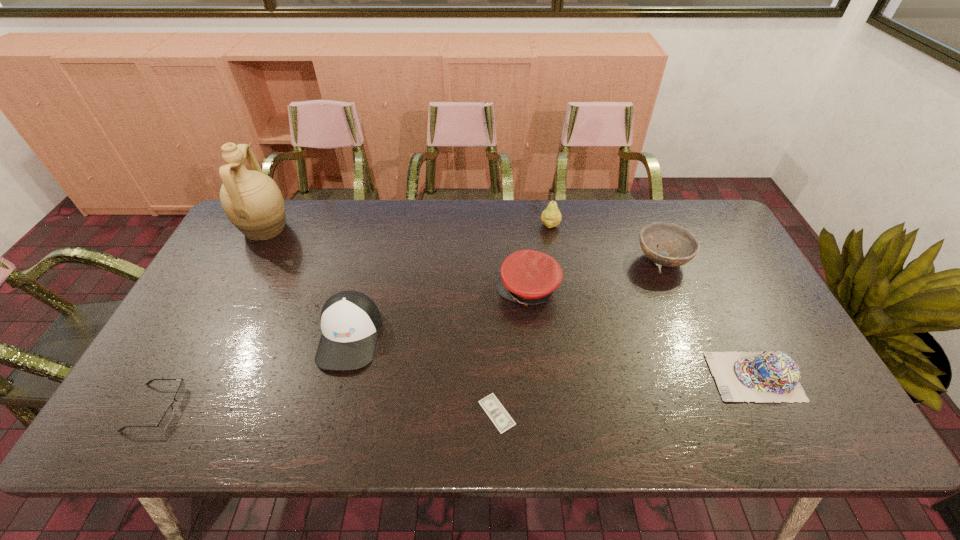
Locate an element on the screen. The image size is (960, 540). blank region between the spectacles and the pitcher is located at coordinates (210, 318).

This screenshot has width=960, height=540. What are the coordinates of `unoccupied position between the leftmost cap and the second shortest object` in the screenshot? It's located at (253, 372).

Locate an element on the screen. This screenshot has width=960, height=540. free space between the tallest object and the shortest cap is located at coordinates (510, 302).

Find the location of a particular element. The height and width of the screenshot is (540, 960). free space between the shortest cap and the second cap from right to left is located at coordinates (641, 333).

Locate an element on the screen. Image resolution: width=960 pixels, height=540 pixels. vacant point located between the rightmost cap and the second cap from right to left is located at coordinates (641, 333).

Locate an element on the screen. free spot between the spectacles and the bowl is located at coordinates (409, 334).

Where is `unoccupied area between the third shortest object and the spectacles`? unoccupied area between the third shortest object and the spectacles is located at coordinates (455, 392).

What are the coordinates of `the sixth closest object to the second cap from left to right` in the screenshot? It's located at (252, 201).

You are a GUI agent. You are given a task and a screenshot of the screen. Output one action in this format:
    pyautogui.click(x=<x>, y=<y>)
    Task: Click on the fourth closest object to the pear
    This screenshot has width=960, height=540.
    Given the screenshot: What is the action you would take?
    pyautogui.click(x=350, y=321)

This screenshot has width=960, height=540. Find the location of `cap that is the closest one to the second shortest object`. cap that is the closest one to the second shortest object is located at coordinates (350, 321).